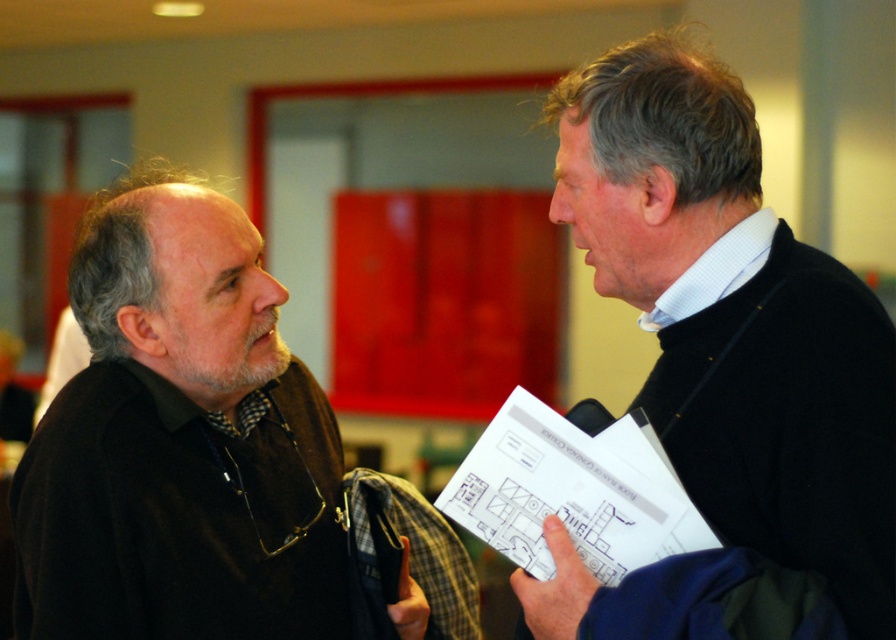
Describe the element at coordinates (793, 426) in the screenshot. This screenshot has height=640, width=896. I see `black sweater at right` at that location.

Between point (668, 260) and point (565, 484), which one is positioned in front?

Point (565, 484)

The image size is (896, 640). I want to click on black sweater at right, so click(x=793, y=426).

Which is more to the right, black matte shirt at left or white paper at center?

From the viewer's perspective, white paper at center appears more on the right side.

Image resolution: width=896 pixels, height=640 pixels. I want to click on black matte shirt at left, so click(179, 442).

Which is behind, point (341, 625) or point (579, 516)?

Point (341, 625)

I want to click on black matte shirt at left, so click(x=179, y=442).

Does black matte shirt at left have a lesser height compared to black sweater at right?

Correct, black matte shirt at left is not as tall as black sweater at right.

Measure the distance between black matte shirt at left and camera.

black matte shirt at left and camera are 1.51 meters apart from each other.

What are the coordinates of `black matte shirt at left` in the screenshot? It's located at (179, 442).